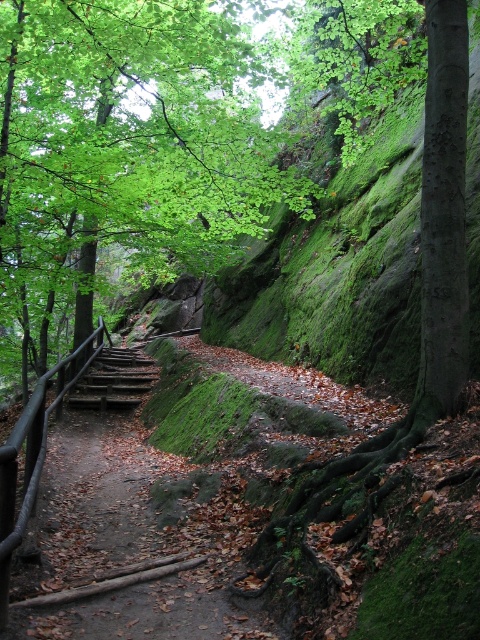
In the scene shown: Is green leafy tree at center further to the viewer compared to rustic wooden stairs at center-left?

No, green leafy tree at center is in front of rustic wooden stairs at center-left.

Is green leafy tree at center below rustic wooden stairs at center-left?

Incorrect, green leafy tree at center is not positioned below rustic wooden stairs at center-left.

I want to click on green leafy tree at center, so click(x=124, y=148).

Does point (189, 573) come closer to viewer compared to point (117, 371)?

That is True.

Is point (110, 397) positioned after point (126, 406)?

Yes, it is behind point (126, 406).

Locate an element on the screen. Image resolution: width=480 pixels, height=640 pixels. dirt path at center is located at coordinates (105, 540).

Does green leafy tree at center appear on the right side of dirt path at center?

In fact, green leafy tree at center is to the left of dirt path at center.

In the scene shown: Does green leafy tree at center have a greater height compared to dirt path at center?

Correct, green leafy tree at center is much taller as dirt path at center.

This screenshot has width=480, height=640. I want to click on green leafy tree at center, so click(124, 148).

Identify the location of green leafy tree at center. (124, 148).